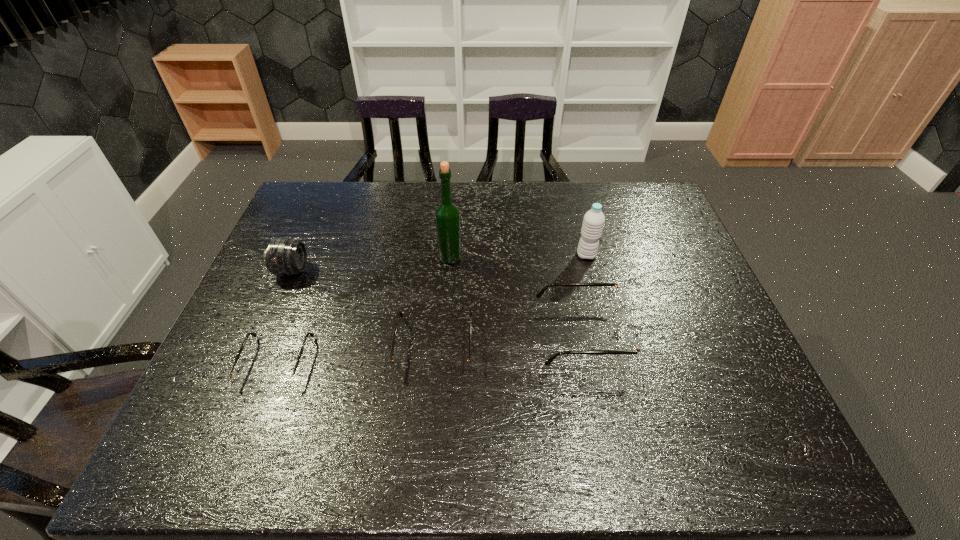
The width and height of the screenshot is (960, 540). Find the location of `vacant space located at the front element of the third tallest object`. vacant space located at the front element of the third tallest object is located at coordinates (372, 271).

Locate an element on the screen. This screenshot has height=540, width=960. vacant space situated on the left of the tallest object is located at coordinates [x=369, y=258].

Where is `vacant space located 0.220m on the back of the water bottle`? The image size is (960, 540). vacant space located 0.220m on the back of the water bottle is located at coordinates (574, 206).

Locate an element on the screen. The height and width of the screenshot is (540, 960). object that is at the near edge is located at coordinates (279, 380).

Find the location of a particular element. This screenshot has width=960, height=540. spectacles located in the left edge section of the desktop is located at coordinates (279, 380).

Where is `telephoto lens that is at the left edge`? telephoto lens that is at the left edge is located at coordinates (284, 256).

Identify the location of object located at the near left corner. (279, 380).

Where is `vacant position at the far edge of the desktop`? vacant position at the far edge of the desktop is located at coordinates [x=345, y=214].

Where is `vacant space at the near edge of the desktop`? Image resolution: width=960 pixels, height=540 pixels. vacant space at the near edge of the desktop is located at coordinates (297, 400).

Image resolution: width=960 pixels, height=540 pixels. What are the coordinates of `free space at the left edge of the desktop` in the screenshot? It's located at (276, 311).